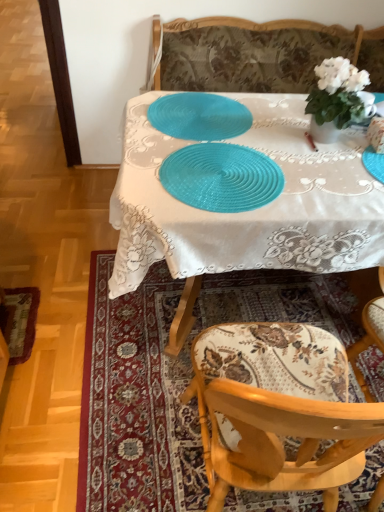
Locate an element on the screen. free point below white glossy vase at upper right (from a real-world perspective) is located at coordinates (334, 135).